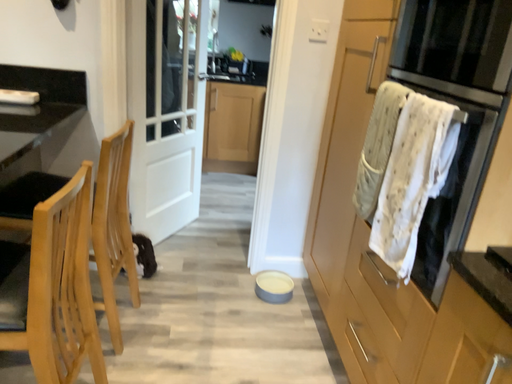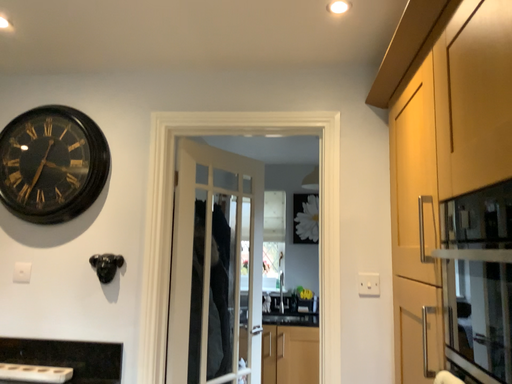
Question: Which way did the camera rotate in the video?

Choices:
 (A) rotated downward
 (B) rotated upward

Answer: (B)